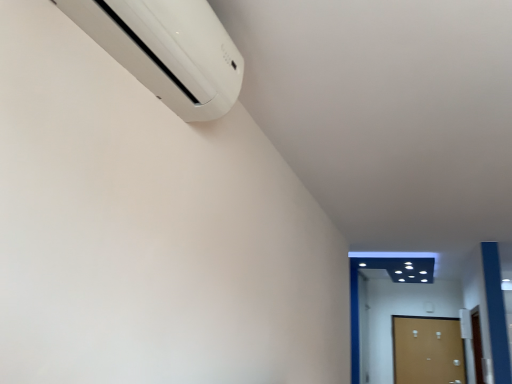
Question: From a real-world perspective, does wooden door at lower right, which ranks as the first door in left-to-right order, stand above brown matte door at lower right, which appears as the 1th door when viewed from the right?

Choices:
 (A) no
 (B) yes

Answer: (B)

Question: Considering the relative positions of wooden door at lower right, which ranks as the first door in left-to-right order, and brown matte door at lower right, which appears as the 1th door when viewed from the right, in the image provided, is wooden door at lower right, which ranks as the first door in left-to-right order, to the right of brown matte door at lower right, which appears as the 1th door when viewed from the right, from the viewer's perspective?

Choices:
 (A) no
 (B) yes

Answer: (A)

Question: Could brown matte door at lower right, marked as the 2th door in a left-to-right arrangement, be considered to be inside wooden door at lower right, which ranks as the first door in left-to-right order?

Choices:
 (A) no
 (B) yes

Answer: (A)

Question: Is wooden door at lower right, which ranks as the first door in left-to-right order, touching brown matte door at lower right, which appears as the 1th door when viewed from the right?

Choices:
 (A) yes
 (B) no

Answer: (B)

Question: Is brown matte door at lower right, which appears as the 1th door when viewed from the right, at the back of wooden door at lower right, the second door positioned from the right?

Choices:
 (A) no
 (B) yes

Answer: (A)

Question: Can you confirm if wooden door at lower right, the second door positioned from the right, is thinner than brown matte door at lower right, which appears as the 1th door when viewed from the right?

Choices:
 (A) no
 (B) yes

Answer: (A)

Question: Is white plastic air conditioner at upper left next to brown matte door at lower right, which appears as the 1th door when viewed from the right, and touching it?

Choices:
 (A) yes
 (B) no

Answer: (B)

Question: Can you confirm if white plastic air conditioner at upper left is taller than brown matte door at lower right, which appears as the 1th door when viewed from the right?

Choices:
 (A) yes
 (B) no

Answer: (B)

Question: Does white plastic air conditioner at upper left turn towards brown matte door at lower right, marked as the 2th door in a left-to-right arrangement?

Choices:
 (A) yes
 (B) no

Answer: (B)

Question: Is white plastic air conditioner at upper left thinner than brown matte door at lower right, marked as the 2th door in a left-to-right arrangement?

Choices:
 (A) yes
 (B) no

Answer: (B)

Question: From a real-world perspective, is white plastic air conditioner at upper left on brown matte door at lower right, marked as the 2th door in a left-to-right arrangement?

Choices:
 (A) no
 (B) yes

Answer: (B)

Question: Is white plastic air conditioner at upper left facing away from brown matte door at lower right, which appears as the 1th door when viewed from the right?

Choices:
 (A) yes
 (B) no

Answer: (B)

Question: Does brown matte door at lower right, which appears as the 1th door when viewed from the right, have a smaller size compared to wooden door at lower right, the second door positioned from the right?

Choices:
 (A) yes
 (B) no

Answer: (A)